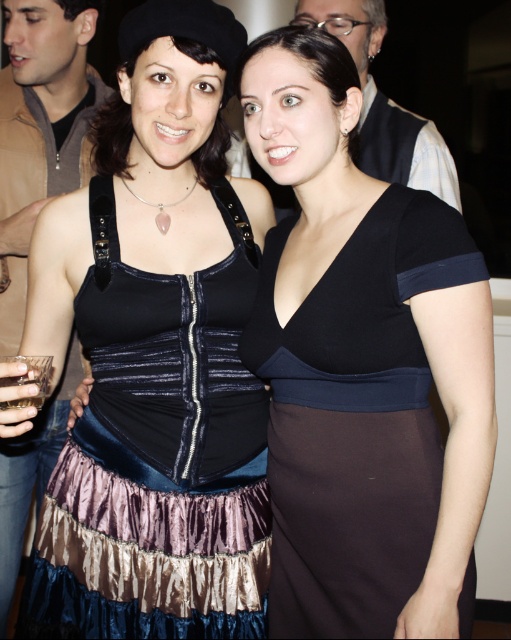
This screenshot has width=511, height=640. Describe the element at coordinates (158, 454) in the screenshot. I see `velvet/ruffled dress at center` at that location.

Between point (238, 225) and point (440, 461), which one is positioned behind?

Point (238, 225)

The width and height of the screenshot is (511, 640). Identify the location of velvet/ruffled dress at center. click(158, 454).